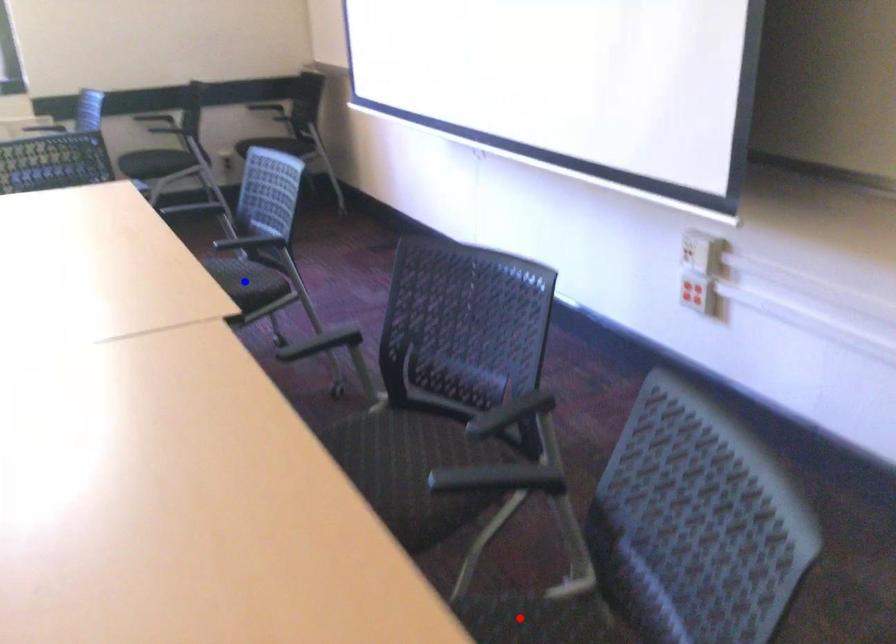
Question: Which of the two points in the image is closer to the camera?

Choices:
 (A) Blue point is closer.
 (B) Red point is closer.

Answer: (B)